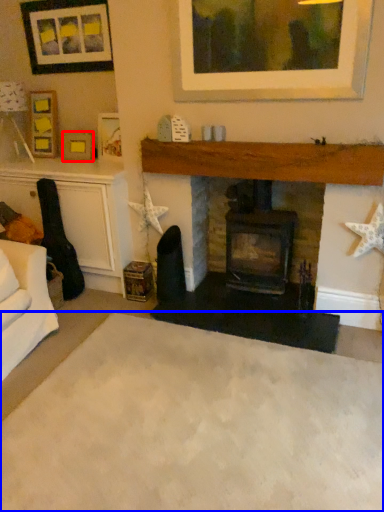
Question: Which object appears farthest to the camera in this image, picture frame (highlighted by a red box) or plain (highlighted by a blue box)?

Choices:
 (A) picture frame
 (B) plain

Answer: (A)